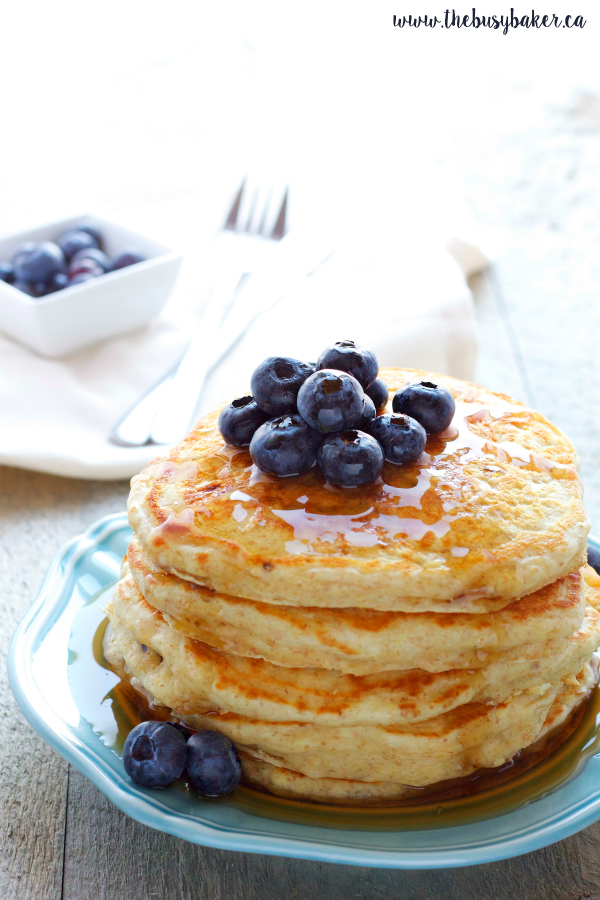
Identify the location of square dish. This screenshot has height=900, width=600. (91, 298).